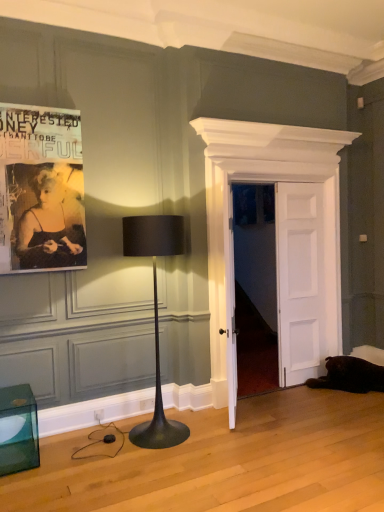
Locate an element on the screen. free space in front of white wooden door at center, which is the 2th door in left-to-right order is located at coordinates (307, 400).